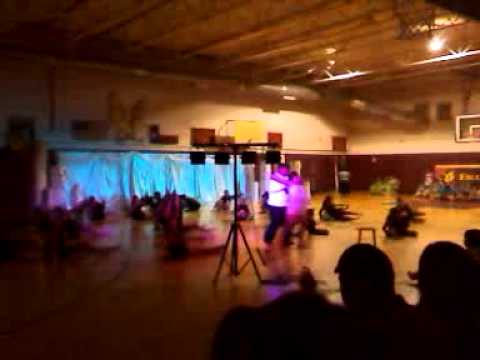
This screenshot has height=360, width=480. I want to click on wall, so click(x=296, y=123), click(x=386, y=134).